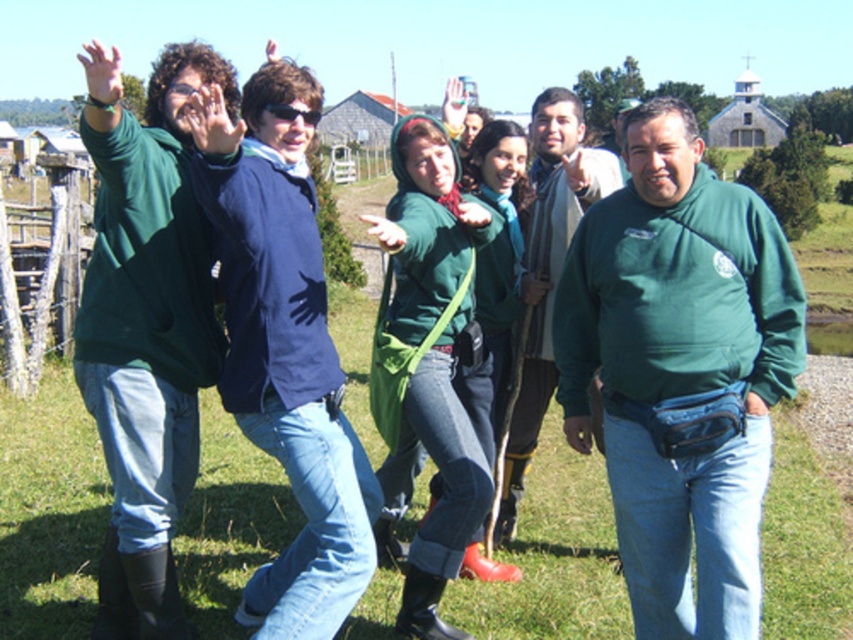
You are taking a photo of the group in the countryside. You notice two points in the image at coordinates point (590, 330) and point (80, 536). Which point is nearer to the camera?

Point (590, 330) is closer to the camera than point (80, 536).